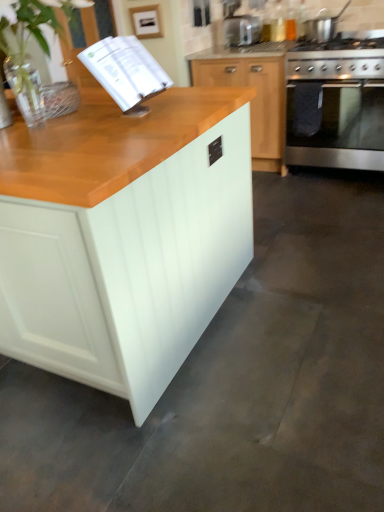
Locate an element on the screen. This screenshot has width=384, height=512. free spot to the right of white paper book at upper left is located at coordinates (196, 106).